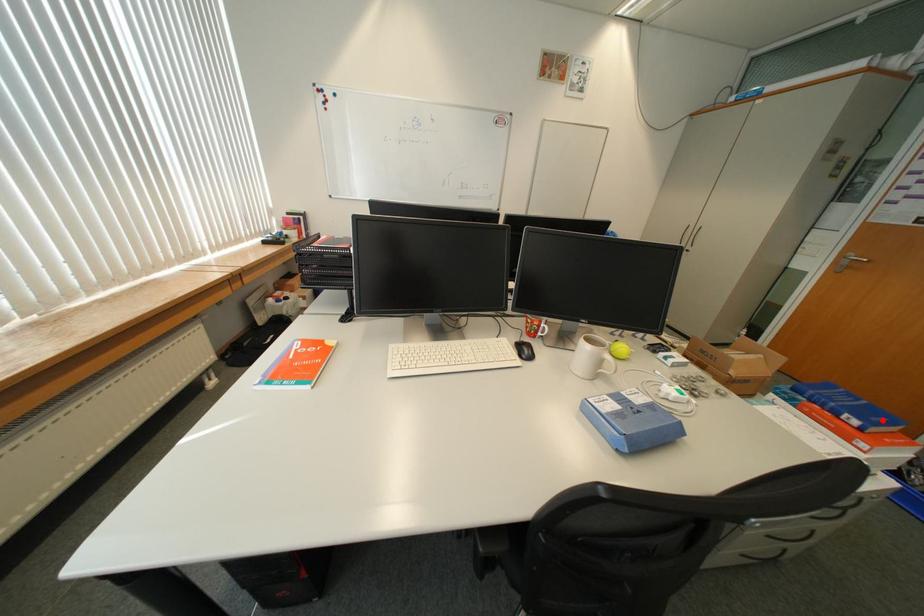
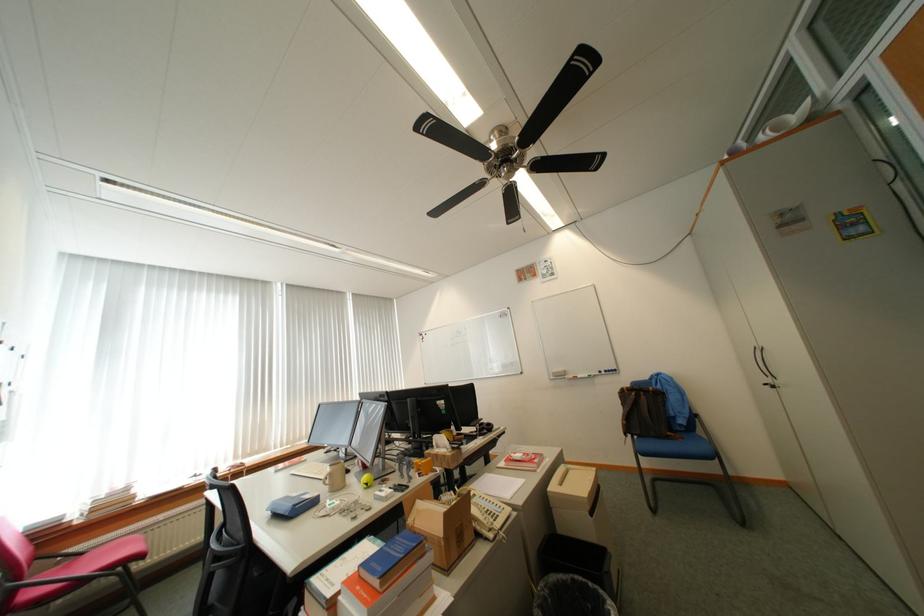
Question: I am providing you with two images of the same scene from different viewpoints. A red point is shown in image1. For the corresponding object point in image2, is it positioned nearer or farther from the camera?

Choices:
 (A) Nearer
 (B) Farther

Answer: (B)